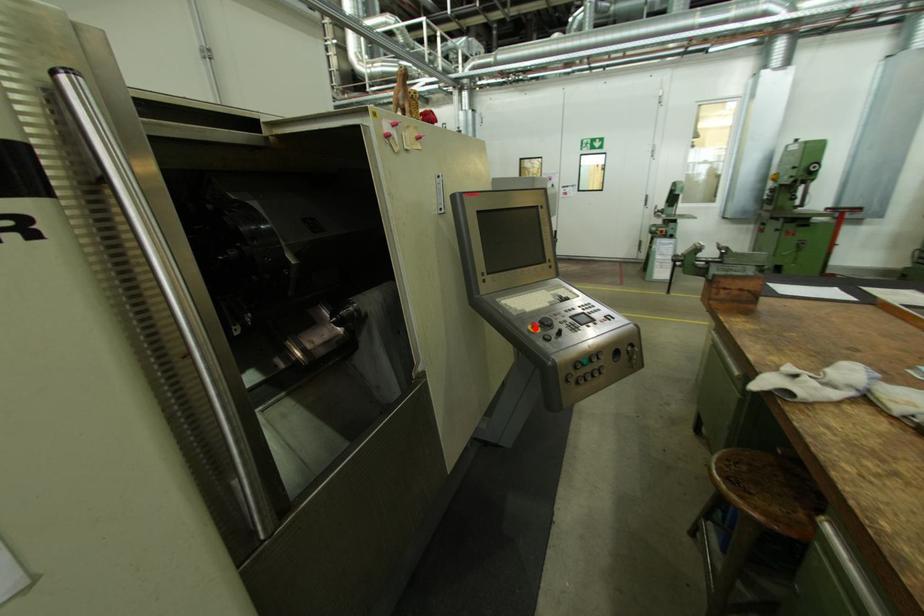
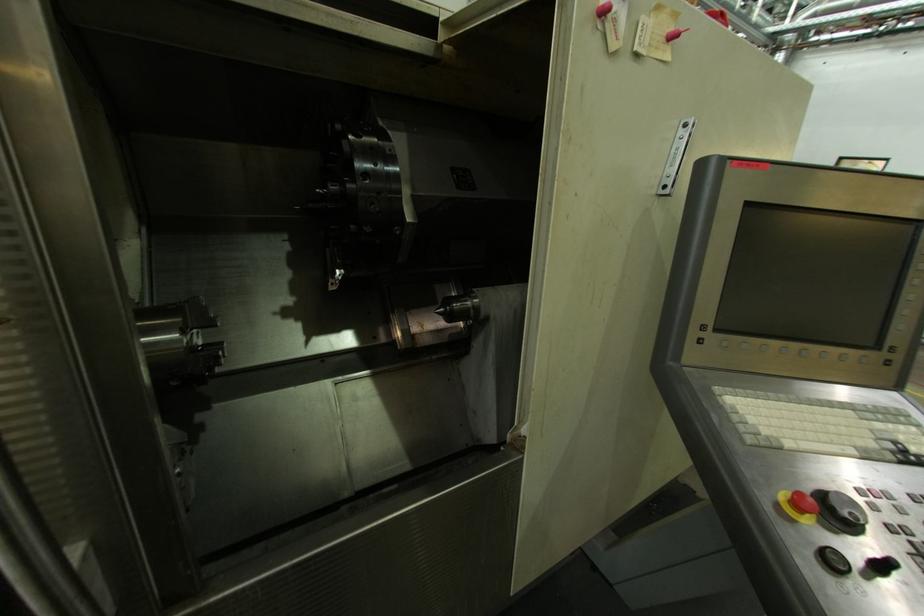
Locate, in the second image, the point that corresponds to the highlighted location in the first image.

(787, 498)